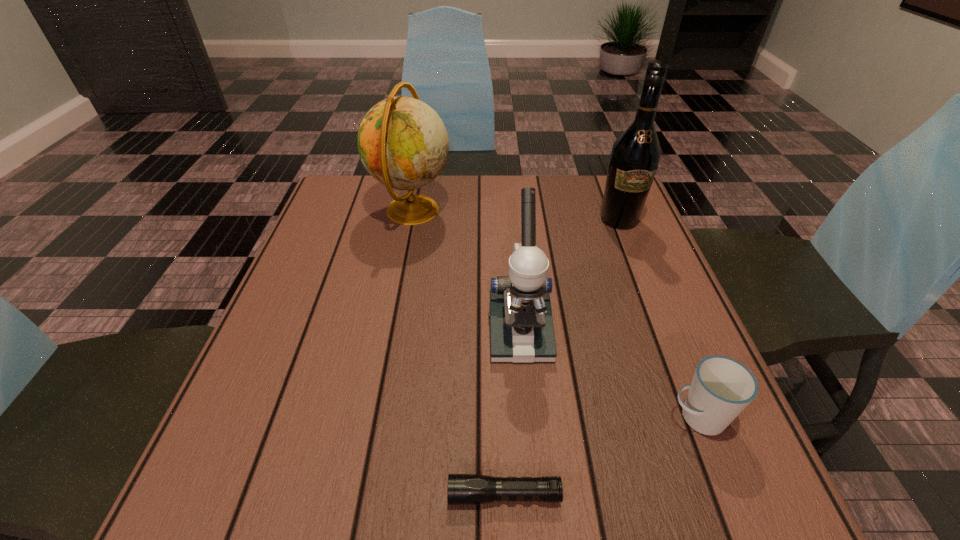
This screenshot has height=540, width=960. In the image, there is a desktop. What are the coordinates of `free region at the near right corner` in the screenshot? It's located at (751, 480).

The height and width of the screenshot is (540, 960). In order to click on free space between the wine bottle and the third nearest object in this screenshot , I will do `click(569, 276)`.

This screenshot has height=540, width=960. Find the location of `vacant region between the leftmost object and the cup`. vacant region between the leftmost object and the cup is located at coordinates click(x=555, y=314).

What are the coordinates of `blank region between the wine bottle and the microscope` in the screenshot? It's located at coord(569,276).

Locate an element on the screen. The width and height of the screenshot is (960, 540). free spot between the nearest object and the globe is located at coordinates (458, 353).

What are the coordinates of `free space between the wine bottle and the leftmost object` in the screenshot? It's located at (516, 215).

Locate an element on the screen. The width and height of the screenshot is (960, 540). free spot between the wine bottle and the nearest object is located at coordinates (562, 357).

The image size is (960, 540). I want to click on blank region between the tallest object and the cup, so click(659, 319).

Where is `free space between the leftmost object and the microscope`? free space between the leftmost object and the microscope is located at coordinates (466, 271).

Locate an element on the screen. Image resolution: width=960 pixels, height=540 pixels. empty location between the globe and the flashlight is located at coordinates (458, 353).